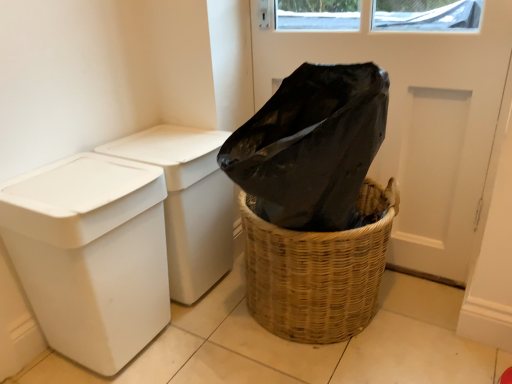
I want to click on free space to the right of white plastic bin at left, which is counted as the second waste container, starting from the back, so (200, 351).